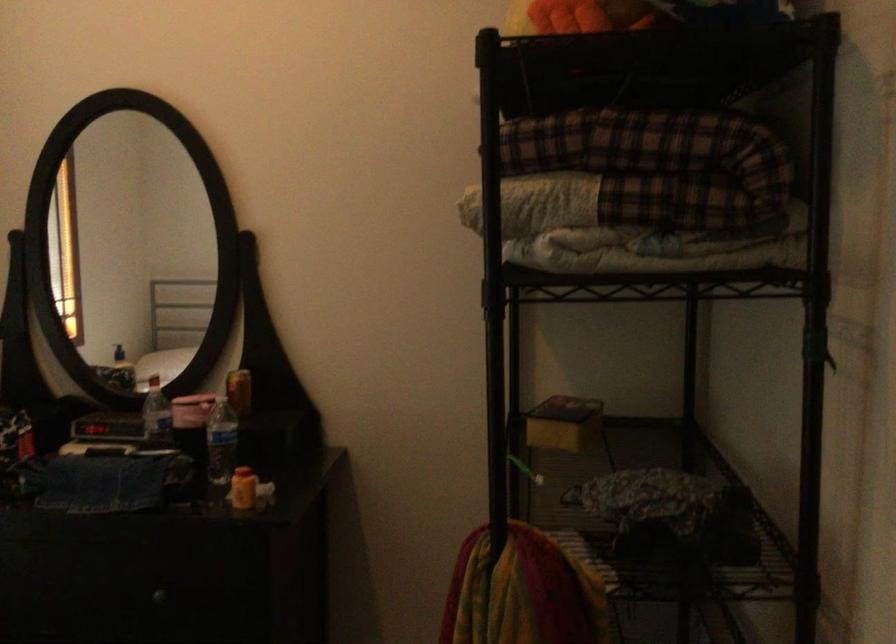
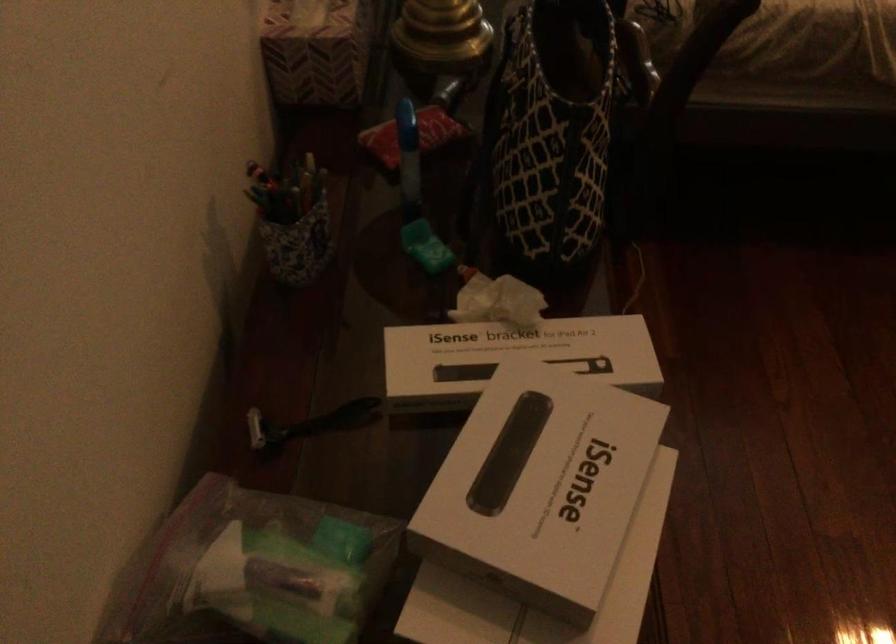
The first image is from the beginning of the video and the second image is from the end. How did the camera likely rotate when shooting the video?

The rotation direction of the camera is left-down.